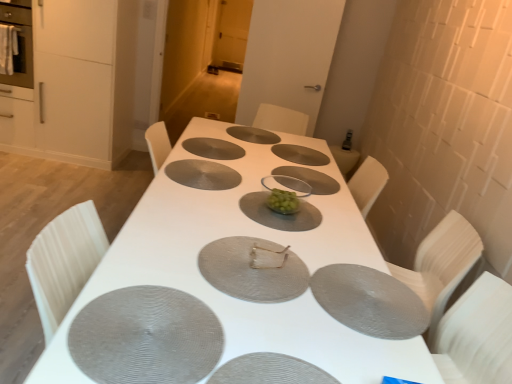
Find the location of `vacant space in gray textured placemat at center, placed as the 7th pizza pan when sorted from back to front (from a real-world perspective)`. vacant space in gray textured placemat at center, placed as the 7th pizza pan when sorted from back to front (from a real-world perspective) is located at coordinates (143, 337).